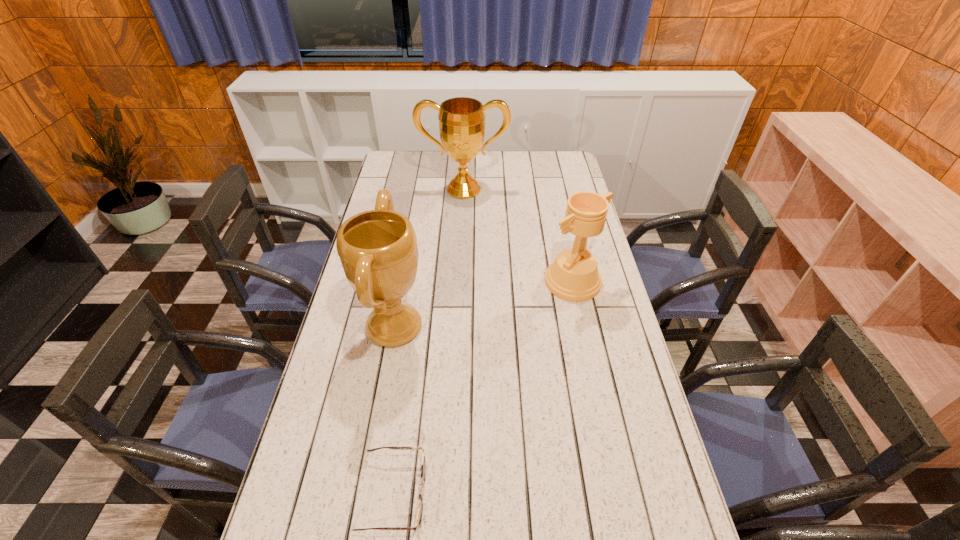
In order to click on the farthest award in this screenshot , I will do `click(461, 120)`.

Where is `the rightmost object`? The image size is (960, 540). the rightmost object is located at coordinates (573, 276).

Identify the location of the rightmost award. click(573, 276).

This screenshot has width=960, height=540. I want to click on the shortest object, so click(x=423, y=466).

Where is `spectacles`? This screenshot has height=540, width=960. spectacles is located at coordinates (423, 466).

Identify the location of free space located 0.120m on the front-facing side of the farthest object. The width and height of the screenshot is (960, 540). (463, 218).

Identify the location of vacant region located on the front of the rightmost award. Image resolution: width=960 pixels, height=540 pixels. [592, 372].

At what (x,y) coordinates should I click in order to perform the action: click on blank space located 0.250m on the frame of the spectacles. Please return your answer as a coordinate pair (x, y). The width and height of the screenshot is (960, 540). Looking at the image, I should click on (533, 494).

You are a GUI agent. You are given a task and a screenshot of the screen. Output one action in this format:
    pyautogui.click(x=<x>, y=<y>)
    Task: Click on the object positioned at the left edge
    
    Given the screenshot: What is the action you would take?
    pyautogui.click(x=378, y=250)

This screenshot has width=960, height=540. I want to click on object located in the right edge section of the desktop, so click(573, 276).